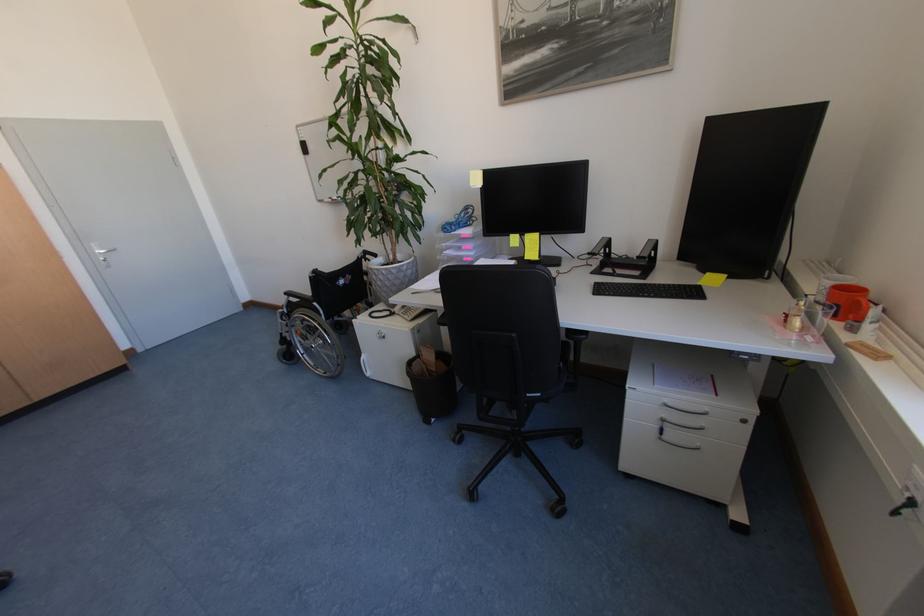
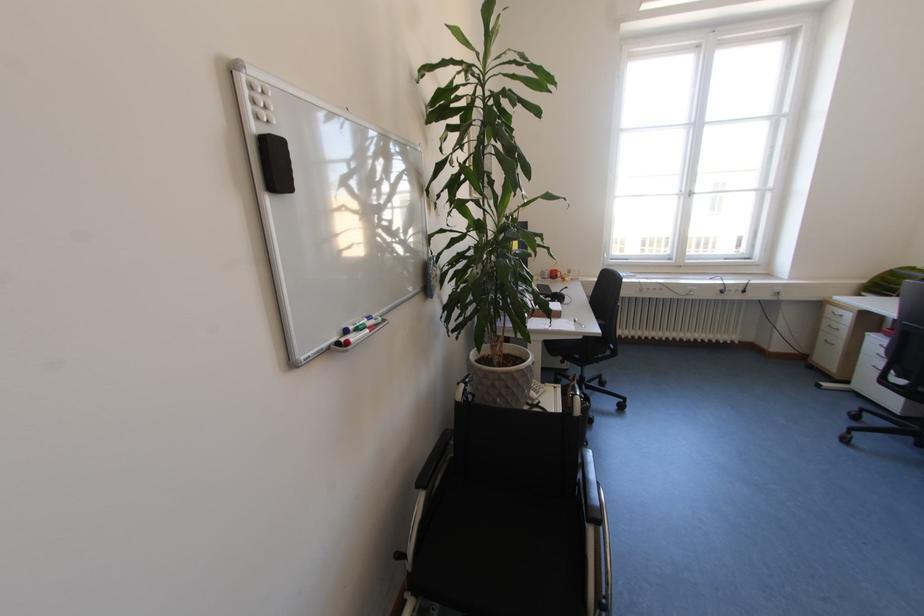
In the second image, find the point that corresponds to pixel 412 315 in the first image.

(546, 392)